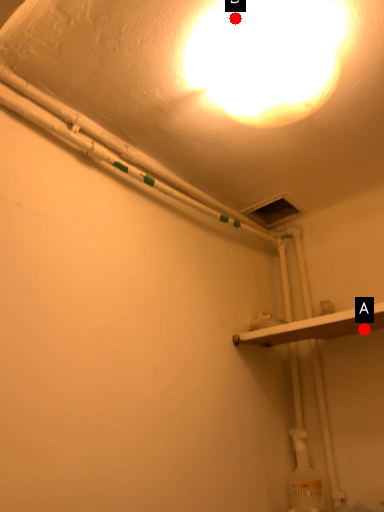
Question: Two points are circled on the image, labeled by A and B beside each circle. Which point appears farthest from the camera in this image?

Choices:
 (A) A is further
 (B) B is further

Answer: (A)